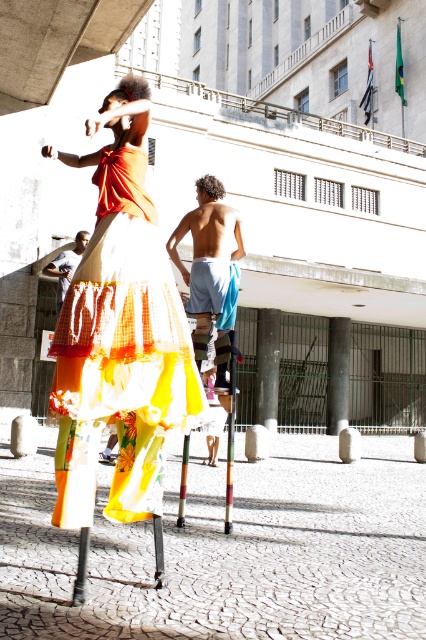
Between floral chiffon dress at center and light blue fabric shorts at center, which one has less height?

light blue fabric shorts at center is shorter.

Is the position of floral chiffon dress at center less distant than that of light blue fabric shorts at center?

Yes, floral chiffon dress at center is closer to the viewer.

What do you see at coordinates (120, 332) in the screenshot?
I see `floral chiffon dress at center` at bounding box center [120, 332].

Locate an element on the screen. This screenshot has height=640, width=426. floral chiffon dress at center is located at coordinates (120, 332).

Between wooden pole at center and matte blue shorts at lower left, which one appears on the right side from the viewer's perspective?

Positioned to the right is wooden pole at center.

Is point (232, 481) positioned behind point (77, 244)?

No, it is not.

The width and height of the screenshot is (426, 640). Describe the element at coordinates (230, 426) in the screenshot. I see `wooden pole at center` at that location.

Where is `wooden pole at center`? wooden pole at center is located at coordinates (230, 426).

From the picture: Can you confirm if light blue fabric shorts at center is positioned above matte blue shorts at lower left?

Incorrect, light blue fabric shorts at center is not positioned above matte blue shorts at lower left.

Does light blue fabric shorts at center have a lesser width compared to matte blue shorts at lower left?

Indeed, light blue fabric shorts at center has a lesser width compared to matte blue shorts at lower left.

Measure the distance between point (207,221) and camera.

Point (207,221) and camera are 6.76 meters apart from each other.

The height and width of the screenshot is (640, 426). I want to click on light blue fabric shorts at center, so click(x=207, y=250).